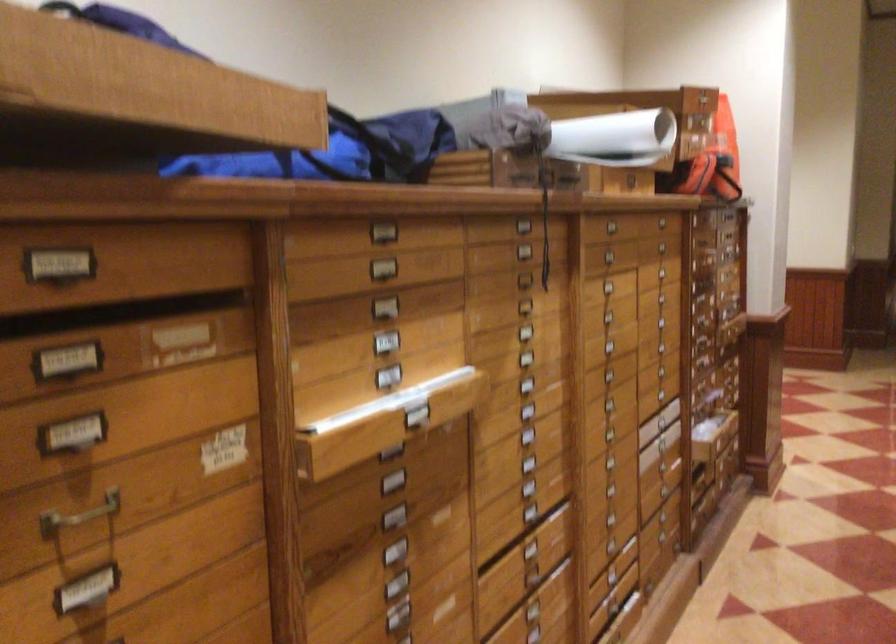
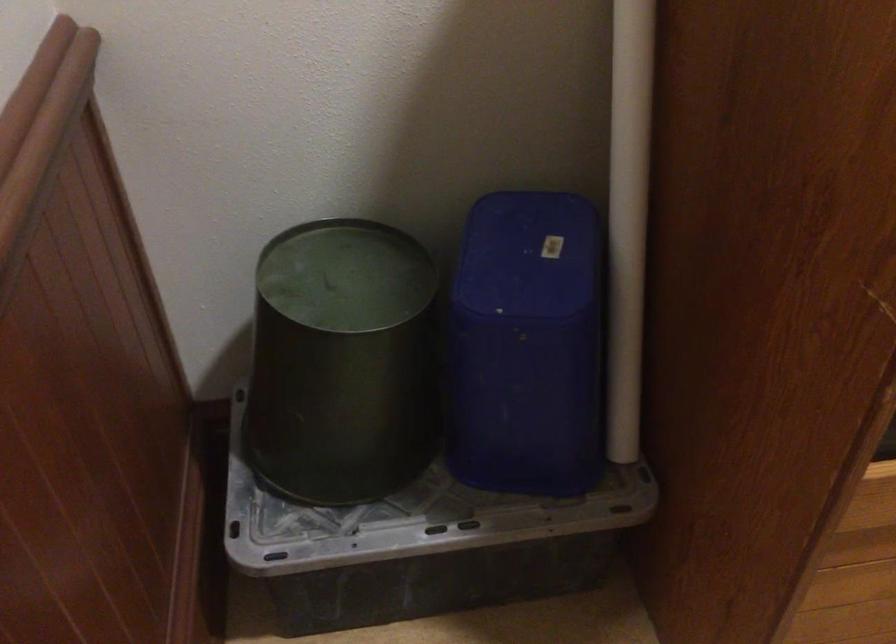
How did the camera likely rotate?

The rotation direction of the camera is left-down.